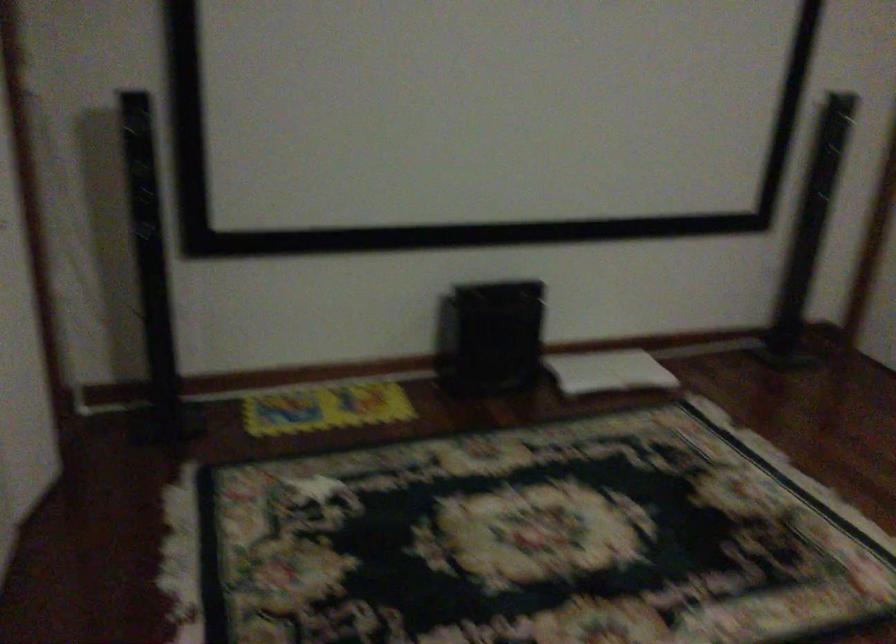
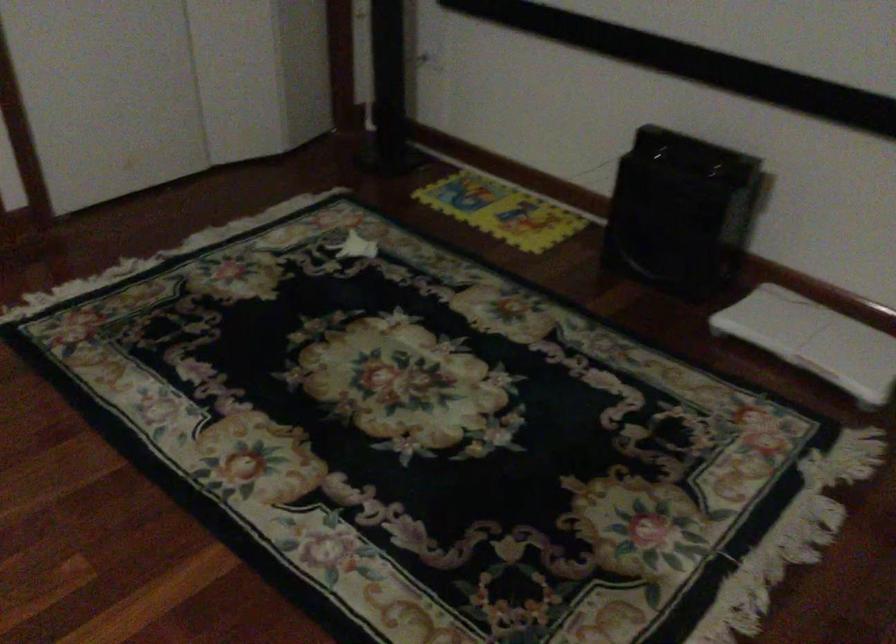
In the second image, find the point that corresponds to point 629,365 in the first image.

(814, 339)